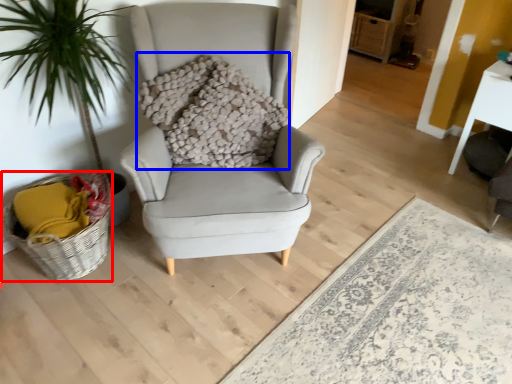
Question: Which object appears farthest to the camera in this image, basket (highlighted by a red box) or pillow (highlighted by a blue box)?

Choices:
 (A) basket
 (B) pillow

Answer: (B)